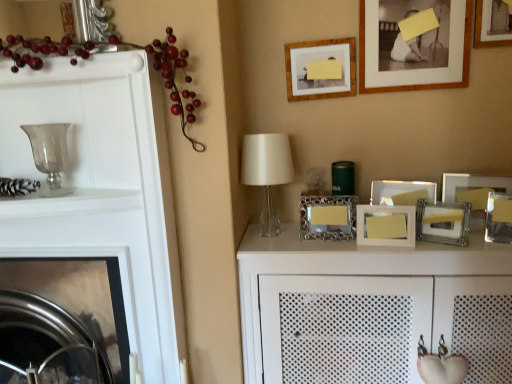
Find the location of a particular element. blank area to the left of metallic silver picture frame at right, the sixth picture frame viewed from the top is located at coordinates (470, 238).